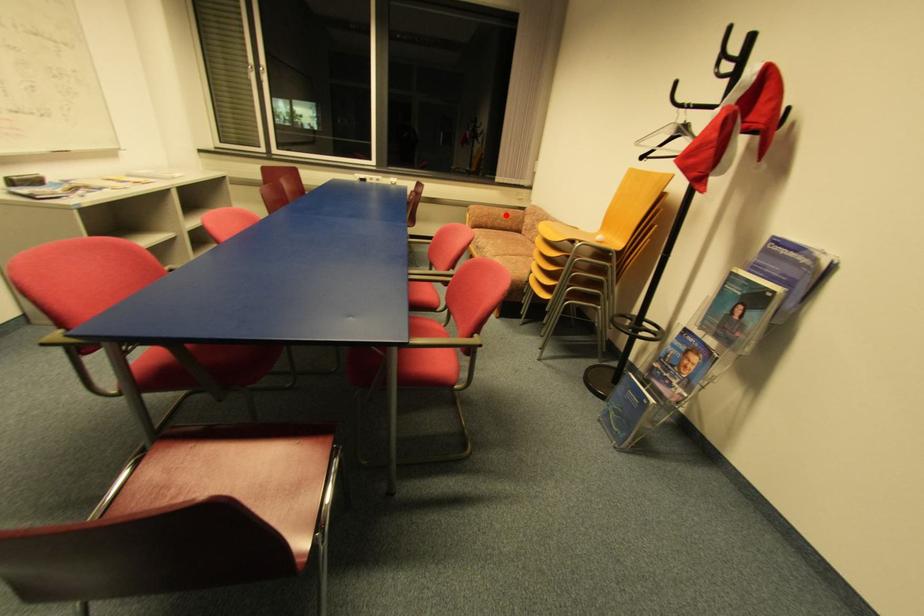
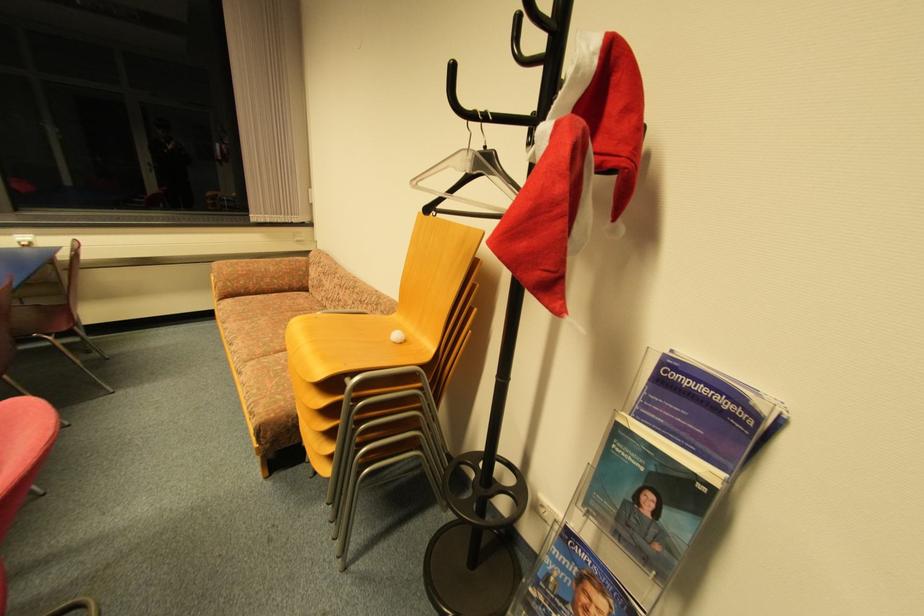
Question: I am providing you with two images of the same scene from different viewpoints. Image1 has a red point marked. In image2, the corresponding 3D location appears at what relative position? Reply with the corresponding letter.

Choices:
 (A) Closer
 (B) Farther

Answer: (B)